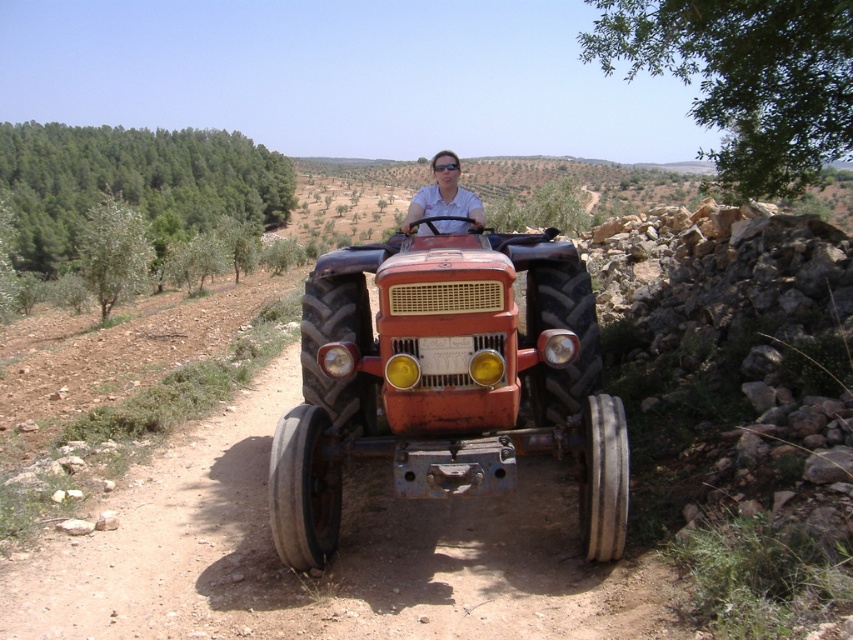
Question: Can you confirm if rustic metal tractor at center is smaller than matte white shirt at center?

Choices:
 (A) yes
 (B) no

Answer: (B)

Question: Is dirt track at center positioned at the back of matte white shirt at center?

Choices:
 (A) yes
 (B) no

Answer: (B)

Question: Based on their relative distances, which object is nearer to the dirt track at center?

Choices:
 (A) matte white shirt at center
 (B) rustic metal tractor at center

Answer: (B)

Question: Among these points, which one is nearest to the camera?

Choices:
 (A) pos(462,388)
 (B) pos(9,582)

Answer: (B)

Question: Which is farther from the matte white shirt at center?

Choices:
 (A) dirt track at center
 (B) rustic metal tractor at center

Answer: (A)

Question: Is dirt track at center thinner than rustic metal tractor at center?

Choices:
 (A) yes
 (B) no

Answer: (B)